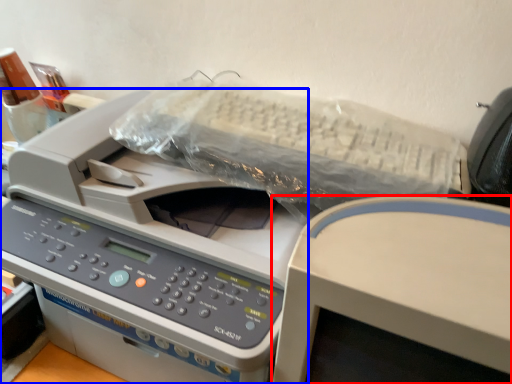
Question: Which object is further to the camera taking this photo, office supplies (highlighted by a red box) or printer (highlighted by a blue box)?

Choices:
 (A) office supplies
 (B) printer

Answer: (B)